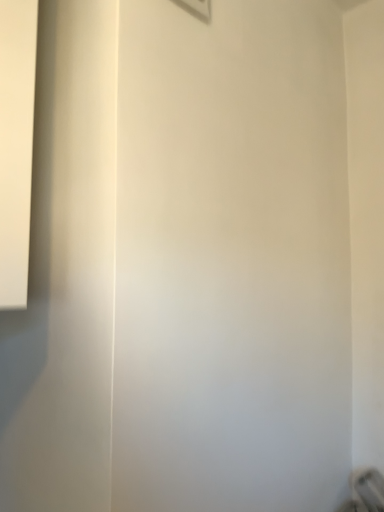
Where is `matte plastic light switch at upper center`? matte plastic light switch at upper center is located at coordinates (197, 8).

This screenshot has height=512, width=384. What do you see at coordinates (197, 8) in the screenshot?
I see `matte plastic light switch at upper center` at bounding box center [197, 8].

In order to click on matte plastic light switch at upper center in this screenshot , I will do `click(197, 8)`.